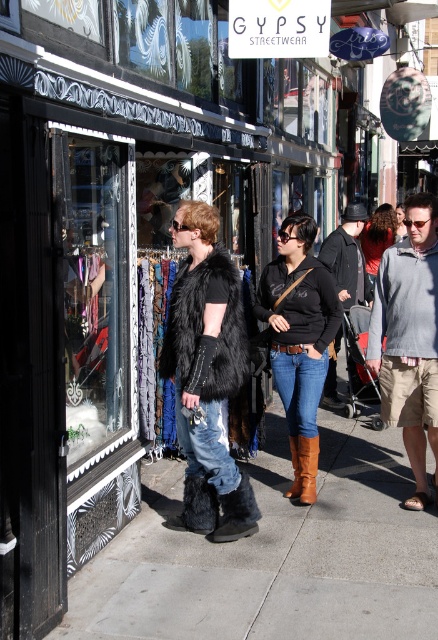
You are a customer at Gypsy Streetwear. You see a woman in a black fur vest and blue jeans standing in front of the store. There is a point marked at coordinates (207, 444). According to the image, where is this point located?

The point at coordinates (207, 444) is located on the denim jeans at center.

Consider the image. You are a fashion designer observing the woman in the scene. You notice her denim jeans at center and black suede boot at lower center. Which item is positioned higher on her body?

The denim jeans at center is above the black suede boot at lower center, so the denim jeans at center is positioned higher on her body.

You are standing at the point with coordinates point (200, 442) and want to walk to the point with coordinates point (285, 292). According to the scene, will you have to walk forward or backward to reach your destination?

According to the scene, point (285, 292) is behind point (200, 442), so you will have to walk backward to reach your destination.